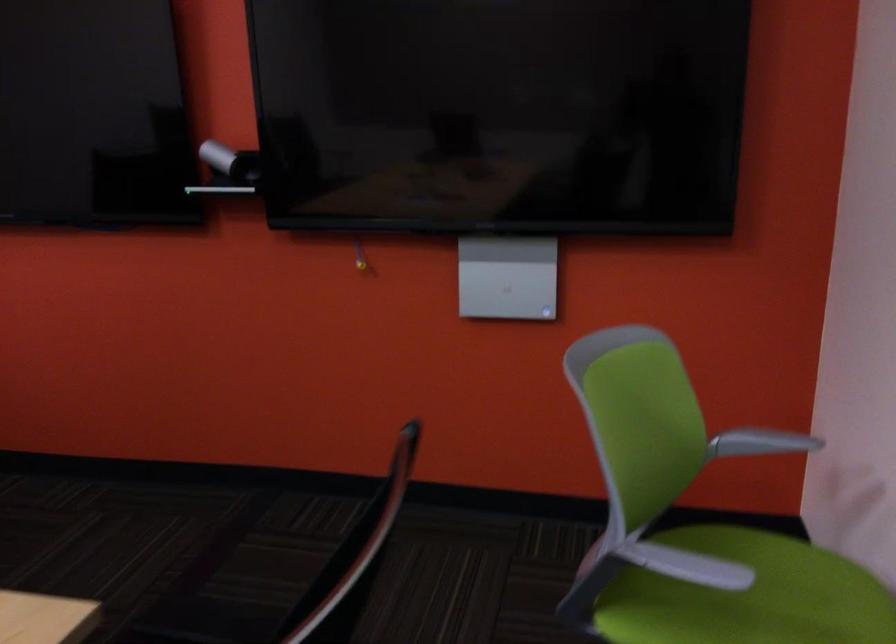
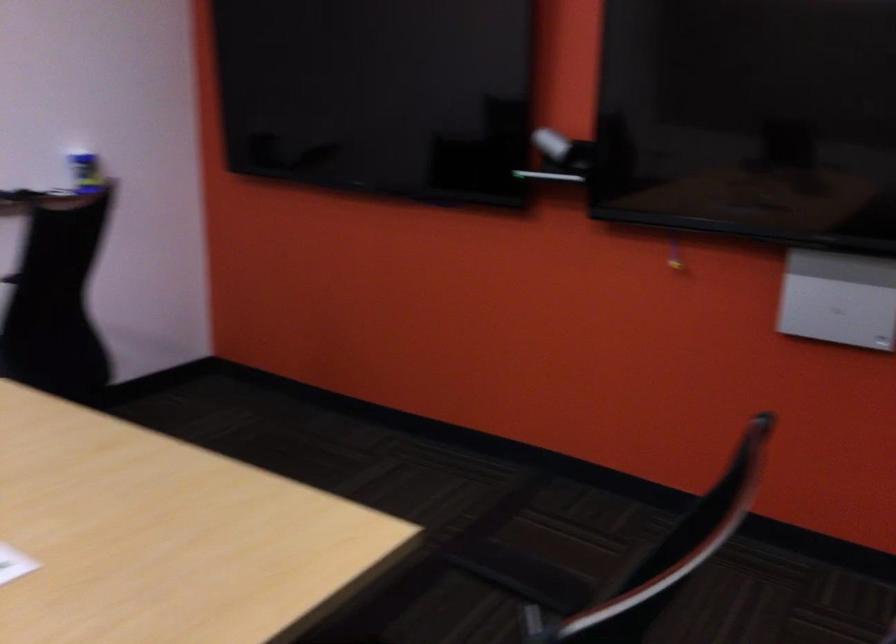
Question: The images are taken continuously from a first-person perspective. In which direction is your viewpoint rotating?

Choices:
 (A) Left
 (B) Right
 (C) Up
 (D) Down

Answer: (A)